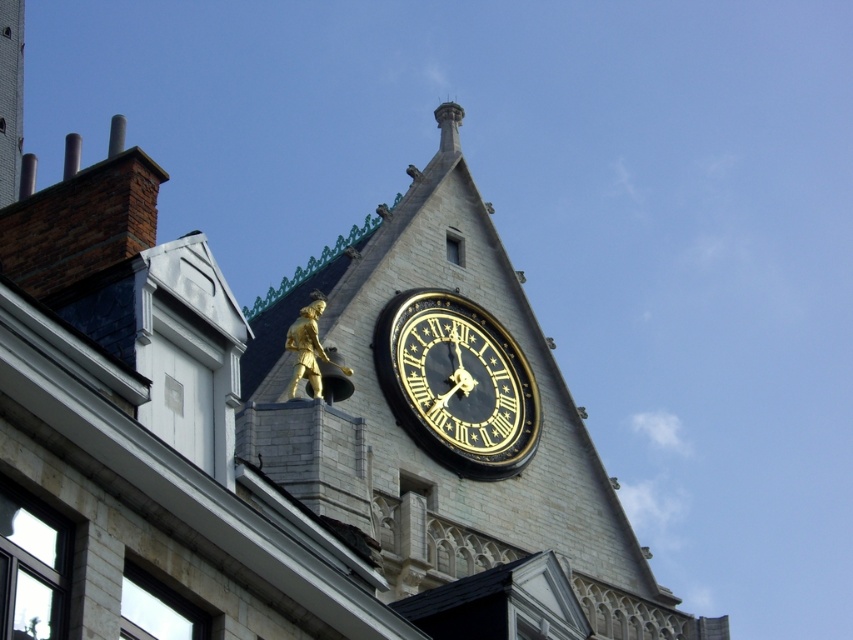
Question: Which point is closer to the camera taking this photo?

Choices:
 (A) (485, 442)
 (B) (412, 561)

Answer: (B)

Question: Is gold statue at upper center positioned behind black polished clock at upper center?

Choices:
 (A) yes
 (B) no

Answer: (B)

Question: Which point is farther from the camera taking this photo?

Choices:
 (A) (323, 458)
 (B) (450, 436)

Answer: (B)

Question: Is gold statue at upper center to the left of black polished clock at upper center from the viewer's perspective?

Choices:
 (A) yes
 (B) no

Answer: (B)

Question: Which point is closer to the camera?

Choices:
 (A) black polished clock at upper center
 (B) gold statue at upper center

Answer: (B)

Question: Is the position of gold statue at upper center more distant than that of black polished clock at upper center?

Choices:
 (A) yes
 (B) no

Answer: (B)